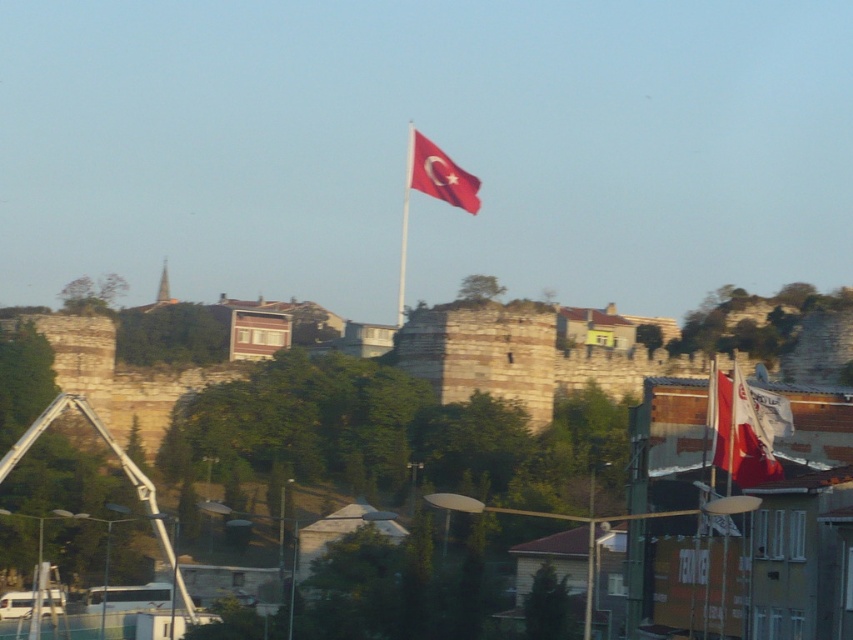
Which is more to the right, red fabric flag at upper center or red fabric flag pole at center?

red fabric flag at upper center is more to the right.

Consider the image. Is red fabric flag at upper center smaller than red fabric flag pole at center?

Yes, red fabric flag at upper center is smaller than red fabric flag pole at center.

Measure the distance between point [427,179] and camera.

They are 237.29 meters apart.

Identify the location of red fabric flag at upper center. (440, 173).

Who is higher up, red fabric flag at right or red fabric flag at upper center?

red fabric flag at upper center

Is point (778, 472) positioned after point (442, 173)?

No.

Find the location of a particular element. red fabric flag at right is located at coordinates (740, 433).

Based on the photo, is red fabric flag at right behind red fabric flag pole at center?

No, it is in front of red fabric flag pole at center.

Between point (762, 429) and point (405, 147), which one is positioned behind?

The point (405, 147) is behind.

Who is more forward, (724, 449) or (399, 294)?

Positioned in front is point (724, 449).

Where is `red fabric flag at right`? red fabric flag at right is located at coordinates (740, 433).